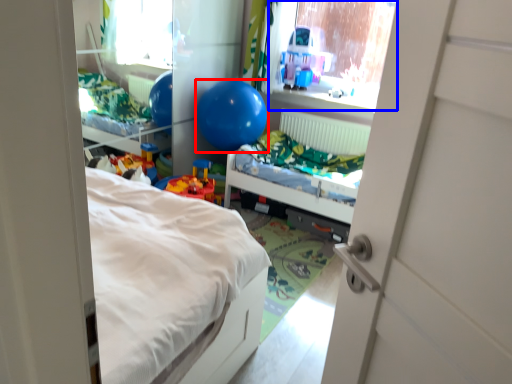
Question: Among these objects, which one is nearest to the camera, balloon (highlighted by a red box) or window screen (highlighted by a blue box)?

Choices:
 (A) balloon
 (B) window screen

Answer: (A)